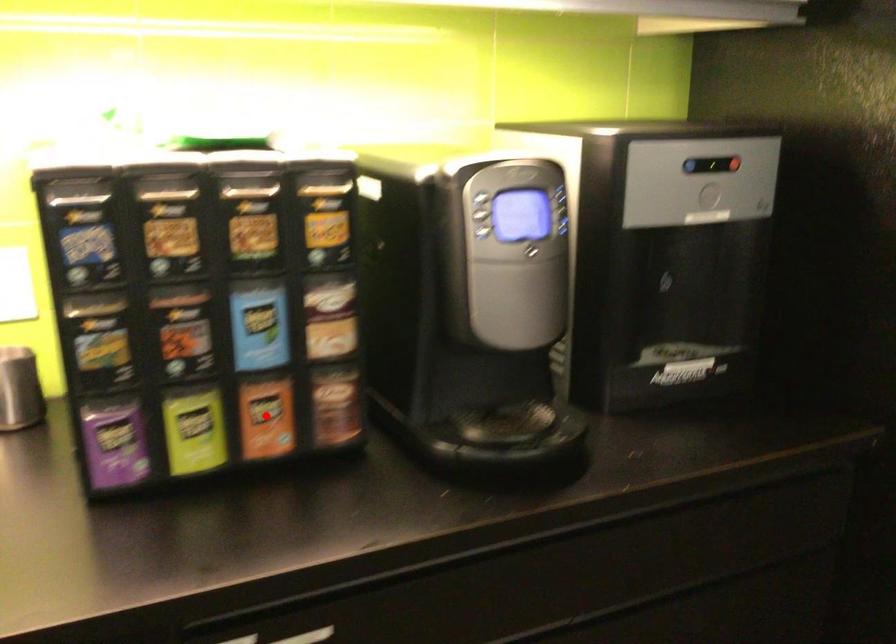
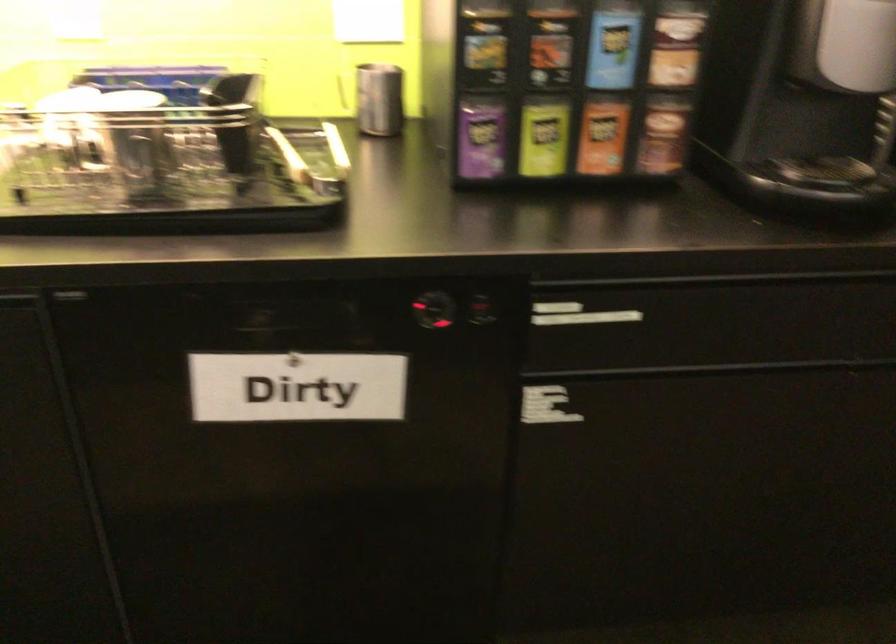
Question: I am providing you with two images of the same scene from different viewpoints. In image1, a red point is highlighted. Considering the same 3D point in image2, which of the following is correct?

Choices:
 (A) It is closer
 (B) It is farther

Answer: (B)